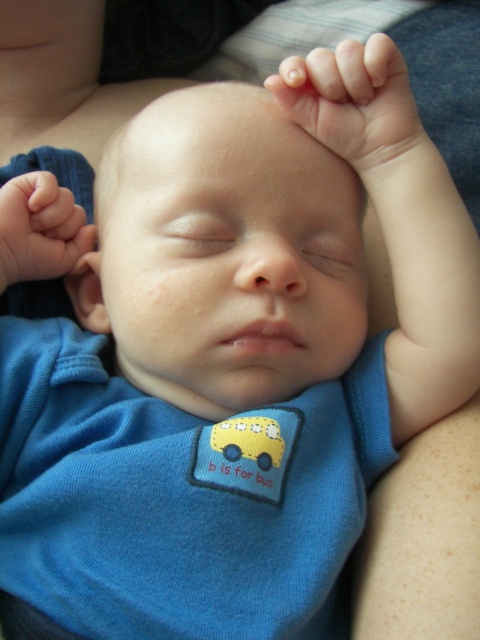
Question: Which point is closer to the camera?

Choices:
 (A) smooth skin hand at upper center
 (B) smooth skin head at center

Answer: (B)

Question: Can you confirm if smooth skin head at center is bigger than smooth skin hand at left?

Choices:
 (A) no
 (B) yes

Answer: (B)

Question: Which of the following is the closest to the observer?

Choices:
 (A) smooth skin head at center
 (B) smooth skin hand at left

Answer: (A)

Question: Is smooth skin hand at upper center above smooth skin hand at left?

Choices:
 (A) no
 (B) yes

Answer: (B)

Question: Which object is closer to the camera taking this photo?

Choices:
 (A) smooth skin hand at upper center
 (B) smooth skin head at center
 (C) smooth skin hand at left

Answer: (B)

Question: Does smooth skin head at center come behind smooth skin hand at upper center?

Choices:
 (A) no
 (B) yes

Answer: (A)